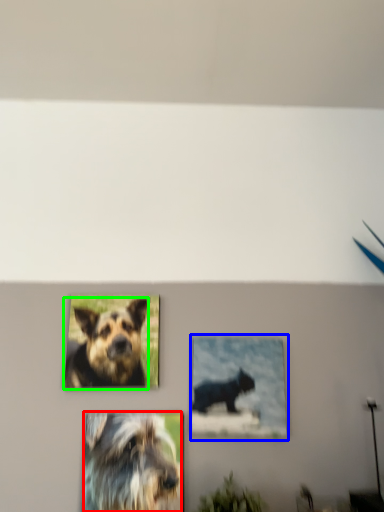
Question: Estimate the real-world distances between objects in this image. Which object is closer to dog (highlighted by a red box), picture frame (highlighted by a blue box) or dog (highlighted by a green box)?

Choices:
 (A) picture frame
 (B) dog

Answer: (B)